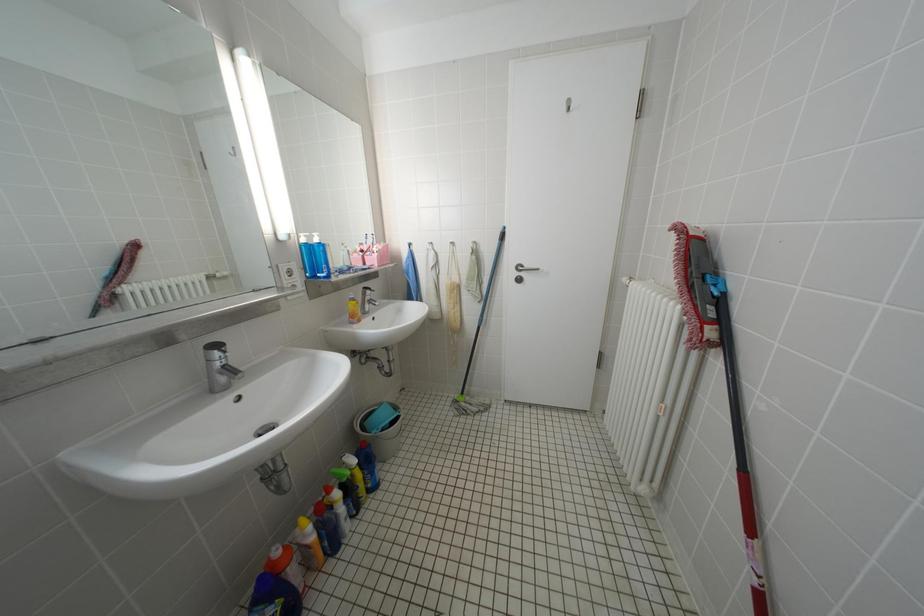
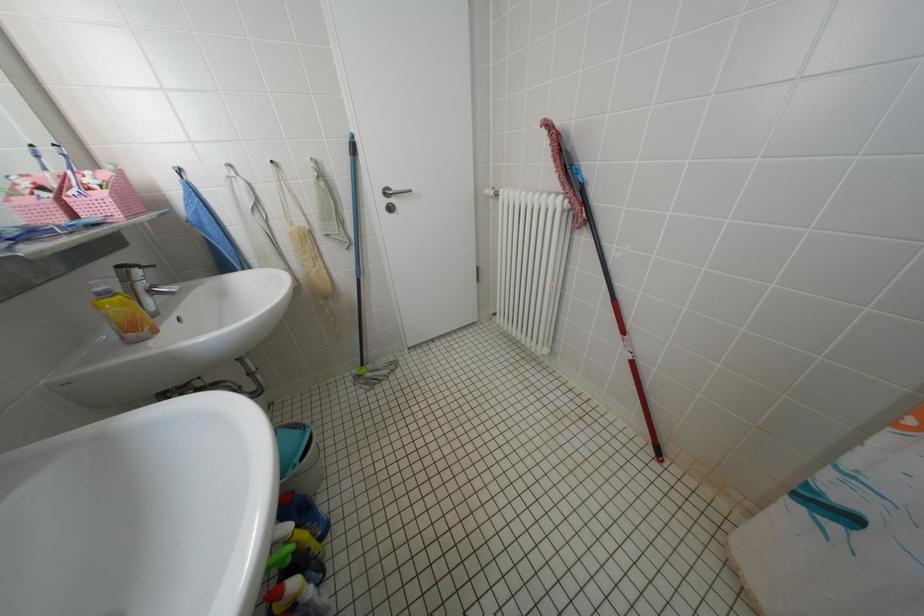
Looking at this image, the images are taken continuously from a first-person perspective. In which direction is your viewpoint rotating?

The camera rotated toward right-down.